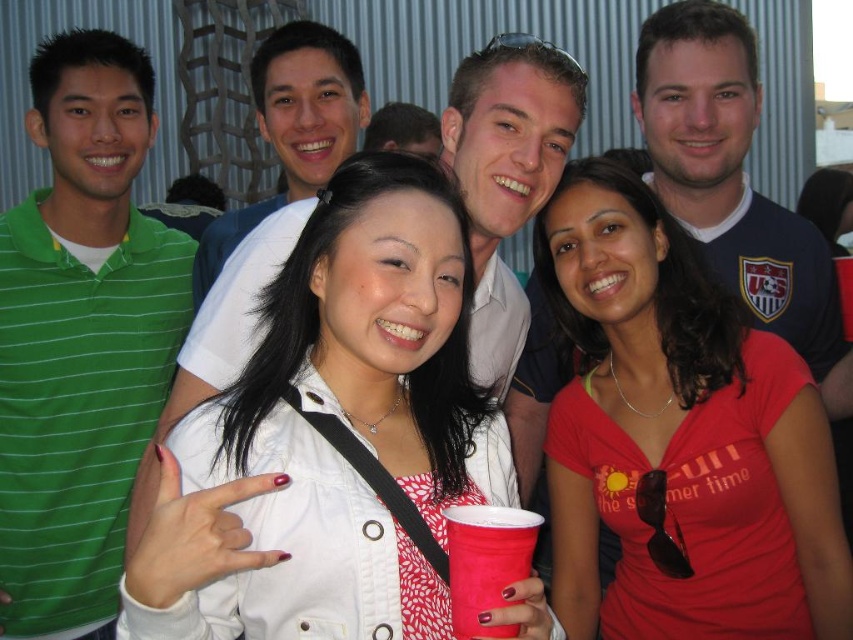
Is matte red shirt at center to the right of matte plastic cup at center from the viewer's perspective?

Indeed, matte red shirt at center is positioned on the right side of matte plastic cup at center.

Does matte red shirt at center lie behind matte plastic cup at center?

Yes, matte red shirt at center is further from the viewer.

Who is more forward, (642, 468) or (473, 621)?

Positioned in front is point (473, 621).

This screenshot has width=853, height=640. In order to click on matte red shirt at center in this screenshot , I will do `click(679, 438)`.

Can you confirm if green striped polo shirt at left is taller than blue jersey at upper right?

Yes, green striped polo shirt at left is taller than blue jersey at upper right.

Can you confirm if green striped polo shirt at left is positioned to the left of blue jersey at upper right?

Yes, green striped polo shirt at left is to the left of blue jersey at upper right.

Find the location of `green striped polo shirt at left`. green striped polo shirt at left is located at coordinates (80, 337).

Where is `green striped polo shirt at left`? green striped polo shirt at left is located at coordinates (80, 337).

Is point (129, 580) positioned behind point (695, 156)?

No, (129, 580) is closer to viewer.

Is white matte jacket at center positioned before blue jersey at upper right?

Yes, white matte jacket at center is closer to the viewer.

Identify the location of white matte jacket at center. This screenshot has height=640, width=853. (341, 416).

I want to click on white matte jacket at center, so click(341, 416).